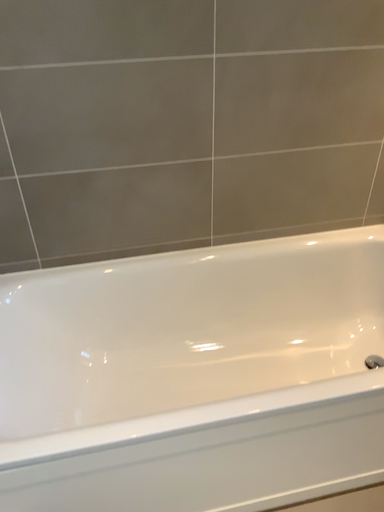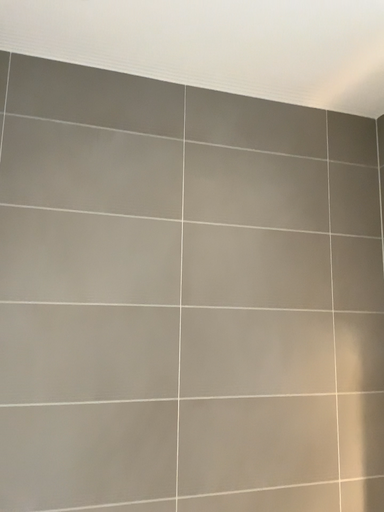
Question: Which way did the camera rotate in the video?

Choices:
 (A) rotated upward
 (B) rotated downward

Answer: (A)